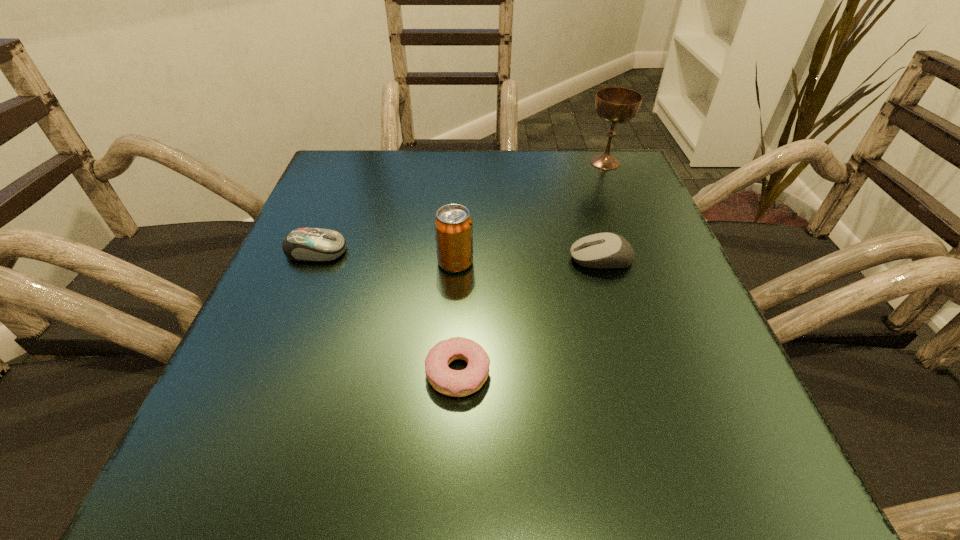
Identify the location of vacant space at the near edge of the desktop. The width and height of the screenshot is (960, 540). tap(452, 446).

Image resolution: width=960 pixels, height=540 pixels. I want to click on free region at the left edge of the desktop, so click(324, 408).

In the image, there is a desktop. In order to click on free space at the right edge in this screenshot , I will do `click(627, 291)`.

Image resolution: width=960 pixels, height=540 pixels. In the image, there is a desktop. Find the location of `vacant space at the far left corner`. vacant space at the far left corner is located at coordinates (330, 191).

Where is `vacant space at the near left corner of the desktop`? vacant space at the near left corner of the desktop is located at coordinates (201, 492).

In the image, there is a desktop. Find the location of `vacant space at the far right corner`. vacant space at the far right corner is located at coordinates (590, 165).

Identify the location of free space at the near right corner. The image size is (960, 540). (773, 483).

Identify the location of vacant region between the fourth shortest object and the doughnut. (457, 318).

Find the location of a particular element. Image resolution: width=960 pixels, height=540 pixels. free space between the leftmost object and the doughnut is located at coordinates (387, 312).

This screenshot has width=960, height=540. Find the location of `unoccupied area between the nearest object and the farthest object`. unoccupied area between the nearest object and the farthest object is located at coordinates [x=532, y=267].